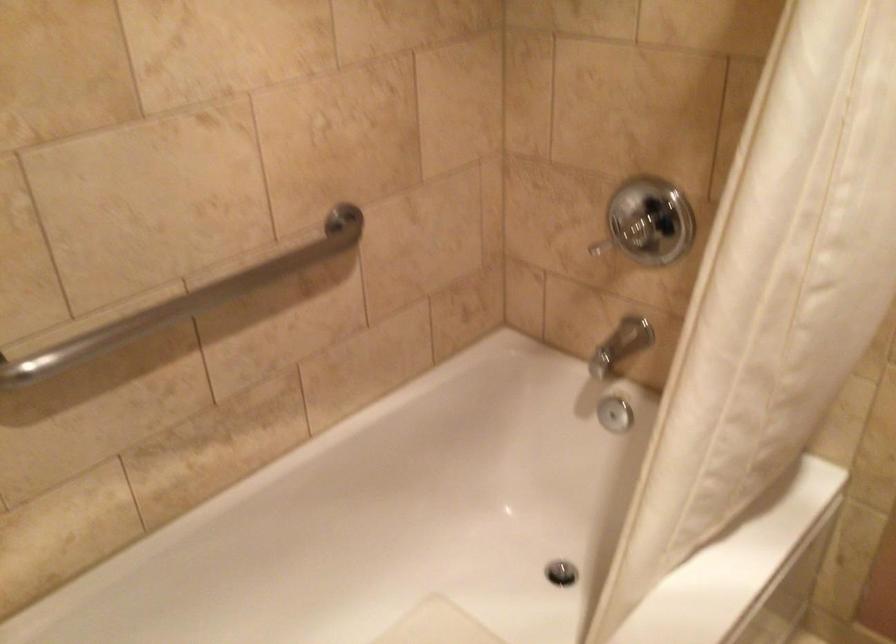
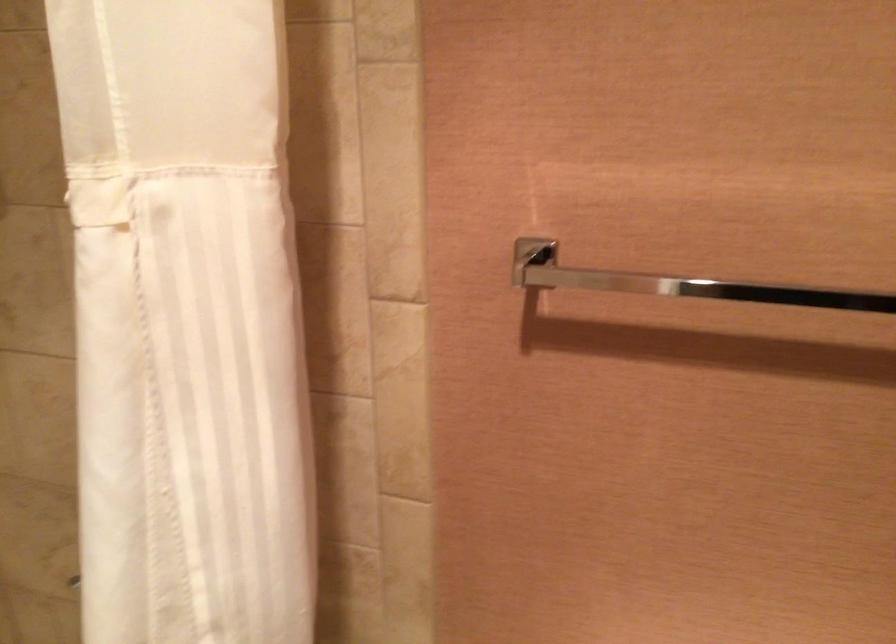
Question: In a continuous first-person perspective shot, in which direction is the camera moving?

Choices:
 (A) Left
 (B) Right
 (C) Forward
 (D) Backward

Answer: (B)